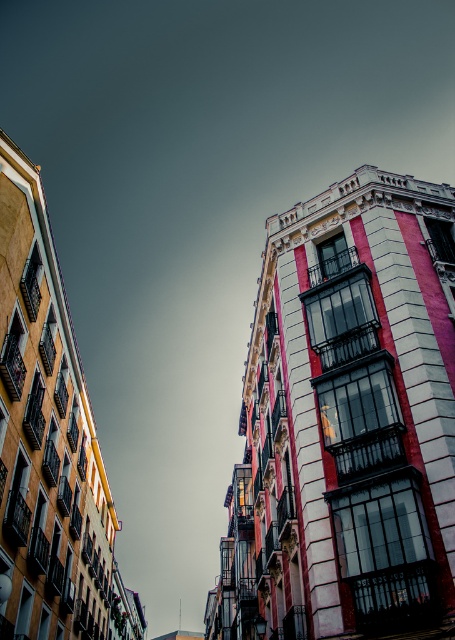
Is smooth pink building at center shorter than yellow painted building at left?

Correct, smooth pink building at center is not as tall as yellow painted building at left.

Is point (421, 248) more distant than point (56, 346)?

No, (421, 248) is closer to viewer.

Who is more forward, (319, 397) or (60, 589)?

Point (319, 397) is in front.

You are a GUI agent. You are given a task and a screenshot of the screen. Output one action in this format:
    pyautogui.click(x=<x>, y=<y>)
    Task: Click on the smooth pink building at center
    
    Given the screenshot: What is the action you would take?
    pyautogui.click(x=347, y=422)